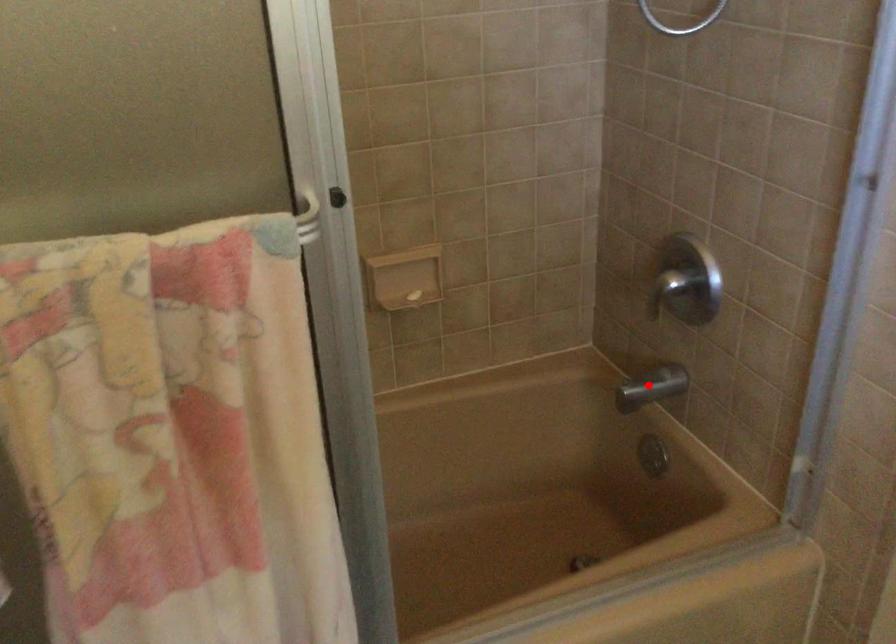
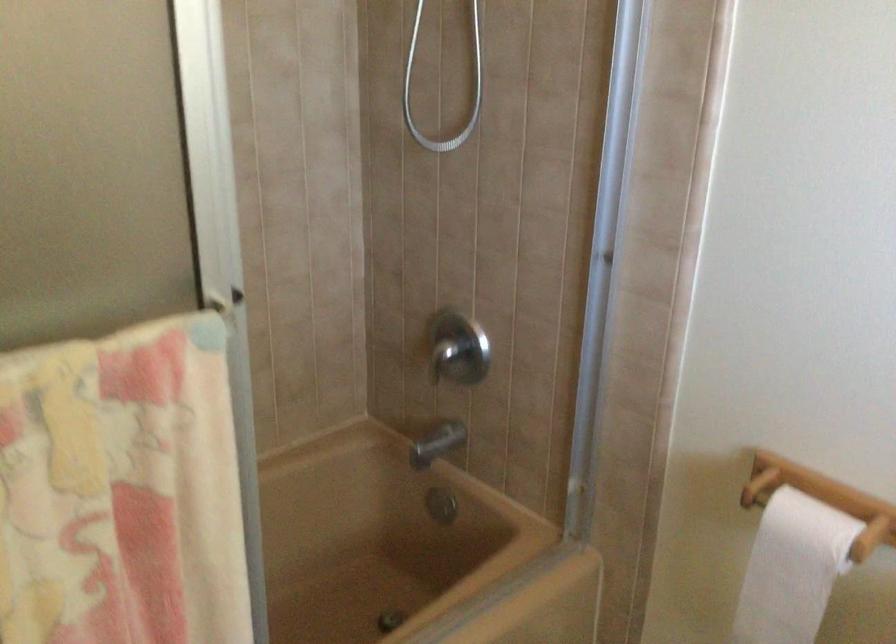
Find the pixel in the second image that matches the highlighted location in the first image.

(436, 444)